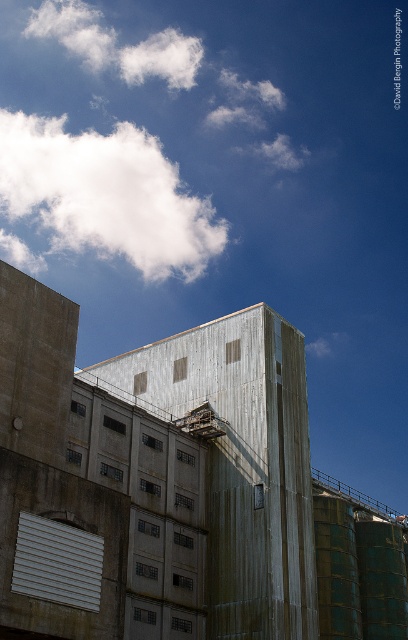
Question: Is rusty metal silo at center thinner than white fluffy cloud at upper left?

Choices:
 (A) no
 (B) yes

Answer: (B)

Question: Which object appears closest to the camera in this image?

Choices:
 (A) rusty metal silo at center
 (B) white fluffy cloud at upper left

Answer: (A)

Question: Which point is farther from the camera taking this photo?

Choices:
 (A) (28, 195)
 (B) (270, 317)

Answer: (A)

Question: Is rusty metal silo at center to the left of white fluffy cloud at upper left from the viewer's perspective?

Choices:
 (A) no
 (B) yes

Answer: (A)

Question: Can you confirm if rusty metal silo at center is smaller than white fluffy cloud at upper left?

Choices:
 (A) yes
 (B) no

Answer: (A)